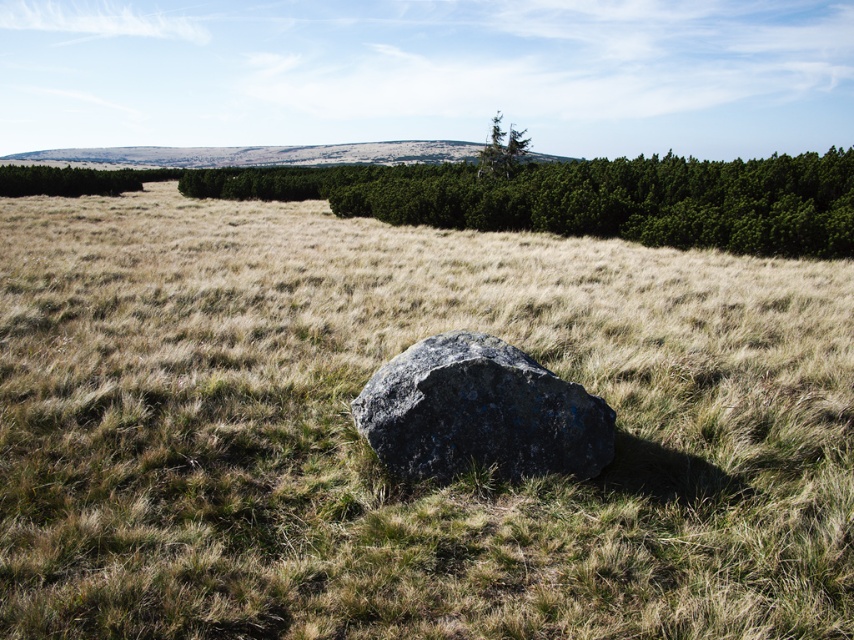
Question: Can you confirm if brown grassy at center is bigger than green textured tree at upper center?

Choices:
 (A) no
 (B) yes

Answer: (A)

Question: Can you confirm if green textured trees at upper center is thinner than green textured tree at upper center?

Choices:
 (A) yes
 (B) no

Answer: (B)

Question: Does green textured trees at upper center have a larger size compared to gray rough boulder at center?

Choices:
 (A) no
 (B) yes

Answer: (B)

Question: Among these objects, which one is nearest to the camera?

Choices:
 (A) gray rough boulder at center
 (B) green textured tree at upper center
 (C) brown grassy at center

Answer: (C)

Question: Which object is the farthest from the gray rough boulder at center?

Choices:
 (A) green textured trees at upper center
 (B) brown grassy at center
 (C) green textured tree at upper center

Answer: (C)

Question: Considering the real-world distances, which object is farthest from the green textured tree at upper center?

Choices:
 (A) brown grassy at center
 (B) gray rough boulder at center

Answer: (B)